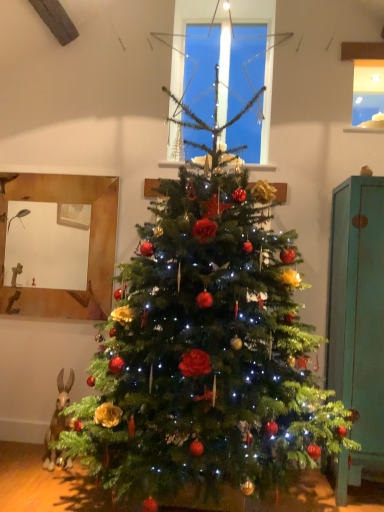
Measure the distance between teal wood cabinet at right and camera.

A distance of 7.36 feet exists between teal wood cabinet at right and camera.

This screenshot has height=512, width=384. What do you see at coordinates (357, 321) in the screenshot?
I see `teal wood cabinet at right` at bounding box center [357, 321].

You are a GUI agent. You are given a task and a screenshot of the screen. Output one action in this format:
    pyautogui.click(x=<x>, y=<y>)
    Task: Click on the teal wood cabinet at right
    The image size is (384, 512).
    Given the screenshot: What is the action you would take?
    pos(357,321)

Image resolution: width=384 pixels, height=512 pixels. What are the coordinates of `clear glass window at upper center` in the screenshot? It's located at (222, 69).

What do you see at coordinates (222, 69) in the screenshot? I see `clear glass window at upper center` at bounding box center [222, 69].

Image resolution: width=384 pixels, height=512 pixels. Find the location of `teal wood cabinet at right`. teal wood cabinet at right is located at coordinates (357, 321).

Which object is positioned more to the left, clear glass window at upper center or teal wood cabinet at right?

From the viewer's perspective, clear glass window at upper center appears more on the left side.

Looking at this image, which object is further away from the camera taking this photo, clear glass window at upper center or teal wood cabinet at right?

clear glass window at upper center is more distant.

Is point (211, 113) positioned before point (355, 228)?

That is False.

From the image's perspective, between clear glass window at upper center and teal wood cabinet at right, which one is located above?

clear glass window at upper center.

From a real-world perspective, is clear glass window at upper center below teal wood cabinet at right?

Incorrect, from a real-world perspective, clear glass window at upper center is higher than teal wood cabinet at right.

Based on the photo, considering the sizes of objects clear glass window at upper center and teal wood cabinet at right in the image provided, who is thinner, clear glass window at upper center or teal wood cabinet at right?

clear glass window at upper center is thinner.

Who is shorter, clear glass window at upper center or teal wood cabinet at right?

clear glass window at upper center.

Can you confirm if clear glass window at upper center is bigger than teal wood cabinet at right?

Incorrect, clear glass window at upper center is not larger than teal wood cabinet at right.

Is clear glass window at upper center situated inside teal wood cabinet at right or outside?

clear glass window at upper center is not inside teal wood cabinet at right, it's outside.

From the picture: Would you consider clear glass window at upper center to be distant from teal wood cabinet at right?

Absolutely, clear glass window at upper center is distant from teal wood cabinet at right.

Is clear glass window at upper center aimed at teal wood cabinet at right?

No, clear glass window at upper center is not oriented towards teal wood cabinet at right.

What's the angular difference between clear glass window at upper center and teal wood cabinet at right's facing directions?

They differ by 0.335 degrees in their facing directions.

In order to click on armoire below the clear glass window at upper center (from the image's perspective) in this screenshot , I will do `click(357, 321)`.

Between teal wood cabinet at right and clear glass window at upper center, which one appears on the right side from the viewer's perspective?

teal wood cabinet at right.

Based on the photo, considering their positions, is teal wood cabinet at right located in front of or behind clear glass window at upper center?

teal wood cabinet at right is positioned closer to the viewer than clear glass window at upper center.

Which is nearer, (356, 340) or (203, 38)?

The point (356, 340) is closer.

From the image's perspective, between teal wood cabinet at right and clear glass window at upper center, who is located below?

teal wood cabinet at right appears lower in the image.

From a real-world perspective, who is located lower, teal wood cabinet at right or clear glass window at upper center?

teal wood cabinet at right.

In terms of width, does teal wood cabinet at right look wider or thinner when compared to clear glass window at upper center?

Clearly, teal wood cabinet at right has more width compared to clear glass window at upper center.

Does teal wood cabinet at right have a lesser height compared to clear glass window at upper center?

In fact, teal wood cabinet at right may be taller than clear glass window at upper center.

Looking at this image, which of these two, teal wood cabinet at right or clear glass window at upper center, is smaller?

Smaller between the two is clear glass window at upper center.

Can clear glass window at upper center be found inside teal wood cabinet at right?

No, clear glass window at upper center is not inside teal wood cabinet at right.

Is teal wood cabinet at right in contact with clear glass window at upper center?

There is a gap between teal wood cabinet at right and clear glass window at upper center.

Could you tell me if teal wood cabinet at right is facing clear glass window at upper center?

No, teal wood cabinet at right is not oriented towards clear glass window at upper center.

In the scene shown: Can you tell me how much teal wood cabinet at right and clear glass window at upper center differ in facing direction?

0.335 degrees separate the facing orientations of teal wood cabinet at right and clear glass window at upper center.

The height and width of the screenshot is (512, 384). Find the location of `armoire below the clear glass window at upper center (from a real-world perspective)`. armoire below the clear glass window at upper center (from a real-world perspective) is located at coordinates (x=357, y=321).

The height and width of the screenshot is (512, 384). I want to click on window screen located behind the teal wood cabinet at right, so click(222, 69).

Identify the location of window screen on the left of teal wood cabinet at right. (222, 69).